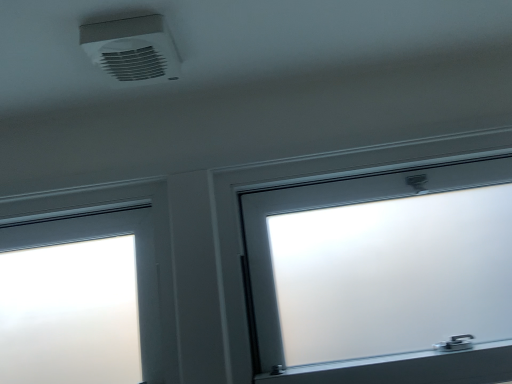
Describe the element at coordinates (384, 276) in the screenshot. I see `frosted glass window at center` at that location.

Measure the distance between frosted glass window at center and camera.

The distance of frosted glass window at center from camera is 33.79 inches.

Identify the location of frosted glass window at center. (384, 276).

In order to face frosted glass window at center, should I rotate leftwards or rightwards?

Turn right approximately 17.753 degrees to face it.

What are the coordinates of `white plastic air conditioning at upper center` in the screenshot? It's located at (132, 50).

Describe the element at coordinates (132, 50) in the screenshot. I see `white plastic air conditioning at upper center` at that location.

This screenshot has height=384, width=512. Find the location of `frosted glass window at center`. frosted glass window at center is located at coordinates (384, 276).

Which is more to the right, frosted glass window at center or white plastic air conditioning at upper center?

Positioned to the right is frosted glass window at center.

Is frosted glass window at center closer to the viewer compared to white plastic air conditioning at upper center?

No, frosted glass window at center is behind white plastic air conditioning at upper center.

Does point (388, 371) lie behind point (98, 55)?

Yes, it is behind point (98, 55).

From the image's perspective, is frosted glass window at center on white plastic air conditioning at upper center?

No, from the image's perspective, frosted glass window at center is not on top of white plastic air conditioning at upper center.

From a real-world perspective, is frosted glass window at center above or below white plastic air conditioning at upper center?

Clearly, from a real-world perspective, frosted glass window at center is below white plastic air conditioning at upper center.

Which object is wider, frosted glass window at center or white plastic air conditioning at upper center?

With larger width is frosted glass window at center.

Looking at this image, considering the relative sizes of frosted glass window at center and white plastic air conditioning at upper center in the image provided, is frosted glass window at center shorter than white plastic air conditioning at upper center?

No, frosted glass window at center is not shorter than white plastic air conditioning at upper center.

Who is bigger, frosted glass window at center or white plastic air conditioning at upper center?

Bigger between the two is frosted glass window at center.

Would you say frosted glass window at center is outside white plastic air conditioning at upper center?

frosted glass window at center lies outside white plastic air conditioning at upper center's area.

Is frosted glass window at center directly adjacent to white plastic air conditioning at upper center?

frosted glass window at center and white plastic air conditioning at upper center are clearly separated.

Is frosted glass window at center aimed at white plastic air conditioning at upper center?

No, frosted glass window at center is not turned towards white plastic air conditioning at upper center.

Where is `window lying behind the white plastic air conditioning at upper center`? window lying behind the white plastic air conditioning at upper center is located at coordinates (384, 276).

Which is more to the left, white plastic air conditioning at upper center or frosted glass window at center?

From the viewer's perspective, white plastic air conditioning at upper center appears more on the left side.

Is white plastic air conditioning at upper center in front of frosted glass window at center?

Yes.

Considering the positions of points (169, 77) and (298, 255), is point (169, 77) closer to camera compared to point (298, 255)?

Yes, point (169, 77) is closer to viewer.

From the image's perspective, does white plastic air conditioning at upper center appear lower than frosted glass window at center?

Incorrect, from the image's perspective, white plastic air conditioning at upper center is higher than frosted glass window at center.

From a real-world perspective, is white plastic air conditioning at upper center physically above frosted glass window at center?

Correct, in the physical world, white plastic air conditioning at upper center is higher than frosted glass window at center.

Considering the sizes of white plastic air conditioning at upper center and frosted glass window at center in the image, is white plastic air conditioning at upper center wider or thinner than frosted glass window at center?

Considering their sizes, white plastic air conditioning at upper center looks slimmer than frosted glass window at center.

Between white plastic air conditioning at upper center and frosted glass window at center, which one has less height?

white plastic air conditioning at upper center.

Can you confirm if white plastic air conditioning at upper center is smaller than frosted glass window at center?

Correct, white plastic air conditioning at upper center occupies less space than frosted glass window at center.

Would you say white plastic air conditioning at upper center is outside frosted glass window at center?

Yes, white plastic air conditioning at upper center is outside of frosted glass window at center.

Is white plastic air conditioning at upper center not near frosted glass window at center?

white plastic air conditioning at upper center is near frosted glass window at center, not far away.

Does white plastic air conditioning at upper center turn towards frosted glass window at center?

A: No, white plastic air conditioning at upper center is not oriented towards frosted glass window at center.

What's the angular difference between white plastic air conditioning at upper center and frosted glass window at center's facing directions?

The angle between the facing direction of white plastic air conditioning at upper center and the facing direction of frosted glass window at center is 0.609 degrees.

The image size is (512, 384). In order to click on air conditioning that is on the left side of frosted glass window at center in this screenshot , I will do click(x=132, y=50).

Locate an element on the screen. This screenshot has height=384, width=512. air conditioning above the frosted glass window at center (from the image's perspective) is located at coordinates (132, 50).

Locate an element on the screen. air conditioning above the frosted glass window at center (from a real-world perspective) is located at coordinates (132, 50).